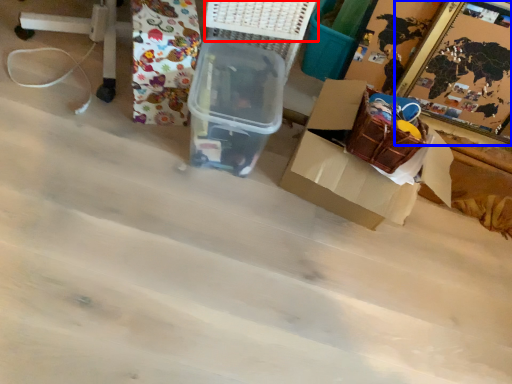
Question: Among these objects, which one is farthest to the camera, basket (highlighted by a red box) or picture frame (highlighted by a blue box)?

Choices:
 (A) basket
 (B) picture frame

Answer: (B)